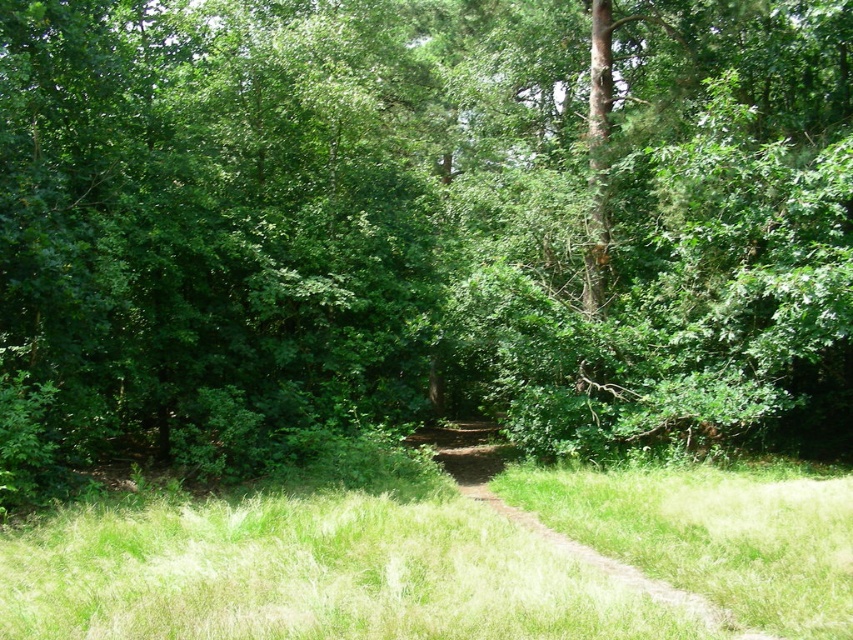
You are a hiker who wants to walk along the dirt path in the forest. You notice the green grass at center and the brown dirt track at center. Which path should you choose to stay on the actual trail?

The brown dirt track at center is the actual trail, so you should choose the brown dirt track at center since the green grass at center is positioned over it, indicating the grass has grown over the track.